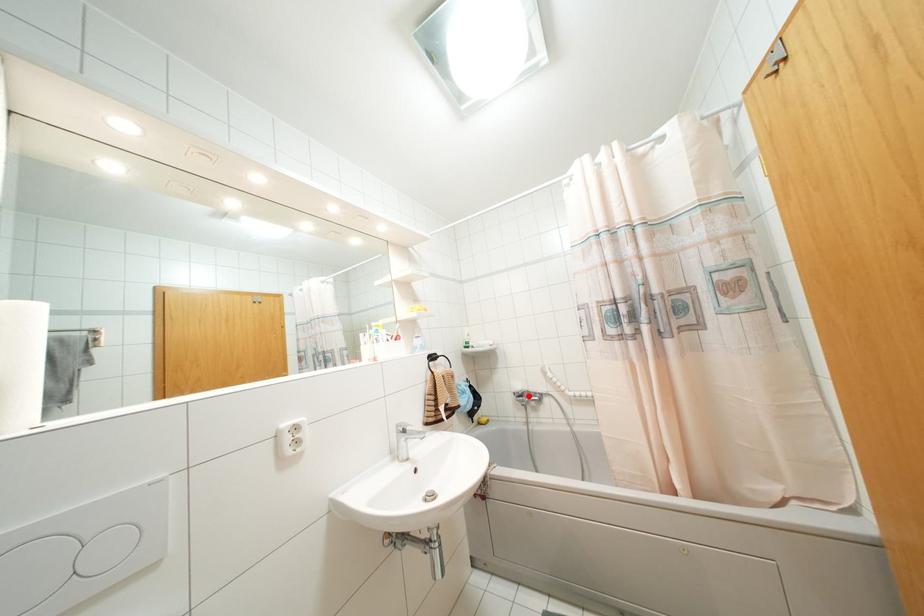
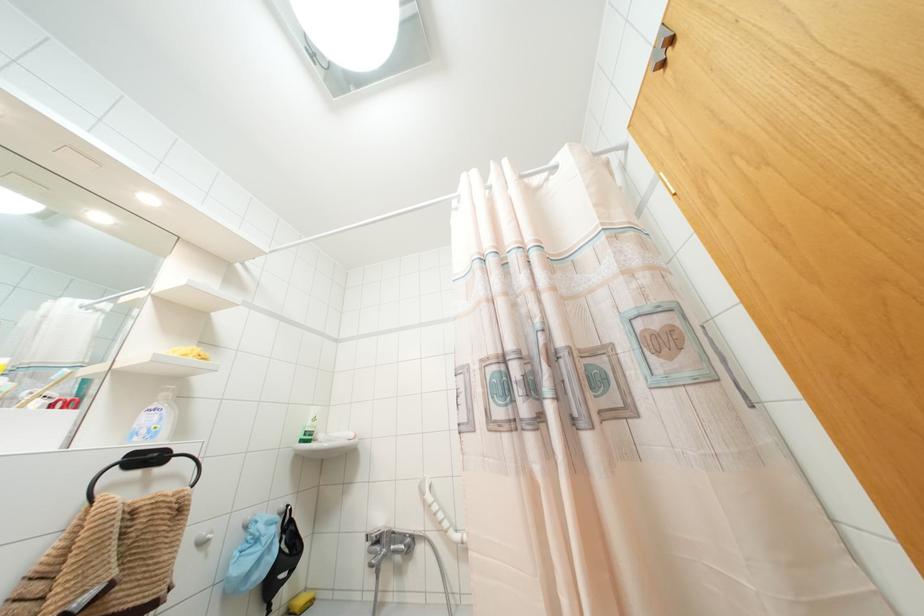
Question: I am providing you with two images of the same scene from different viewpoints. A red point is marked on the first image. Can you still see the location of the red point in image 2?

Choices:
 (A) Yes
 (B) No

Answer: (A)